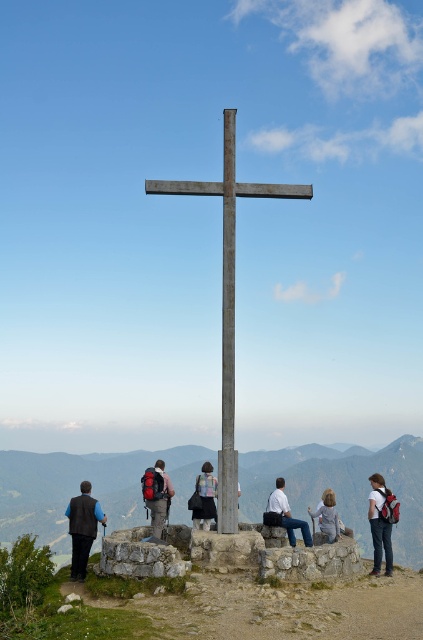
Question: Is matte black backpack at center to the left of light brown leather jacket at center from the viewer's perspective?

Choices:
 (A) yes
 (B) no

Answer: (A)

Question: Considering the relative positions of dark blue vest at lower left and light brown leather jacket at center in the image provided, where is dark blue vest at lower left located with respect to light brown leather jacket at center?

Choices:
 (A) right
 (B) left

Answer: (B)

Question: Which point is farther from the camera taking this photo?

Choices:
 (A) (277, 493)
 (B) (154, 531)

Answer: (A)

Question: Which point is farther from the camera taking this photo?

Choices:
 (A) (290, 541)
 (B) (126, 464)

Answer: (B)

Question: Does smooth stone cross at center appear under dark blue vest at lower left?

Choices:
 (A) no
 (B) yes

Answer: (B)

Question: Which of the following is the farthest from the observer?

Choices:
 (A) (154, 508)
 (B) (233, 218)
 (C) (404, 541)

Answer: (C)